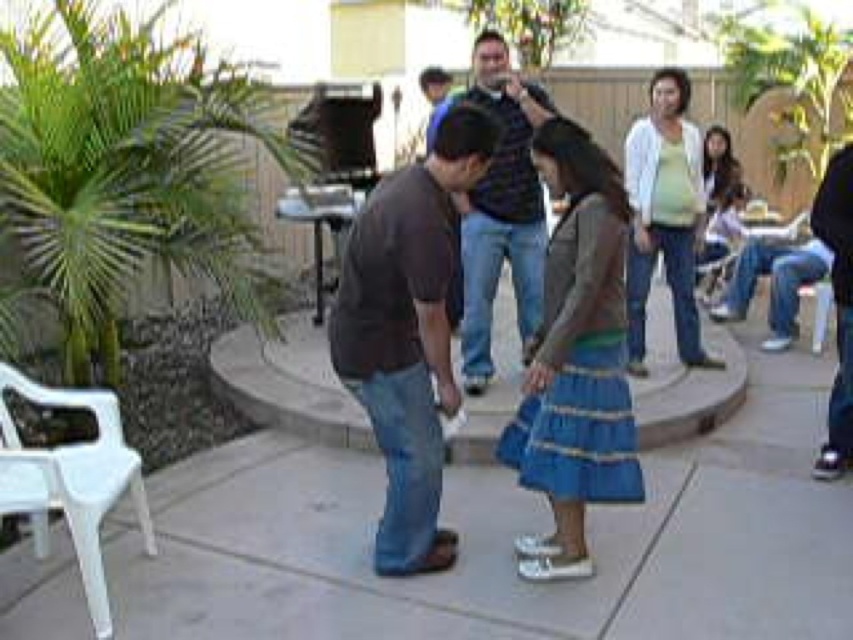
You are a photographer taking a photo of the dancing couple in the center. The brown cotton shirt at center and the blue textured skirt at center are both in your camera frame. Which clothing item appears taller in the photo?

The brown cotton shirt at center appears taller than the blue textured skirt at center in the photo because the brown cotton shirt at center has a greater height compared to the blue textured skirt at center.